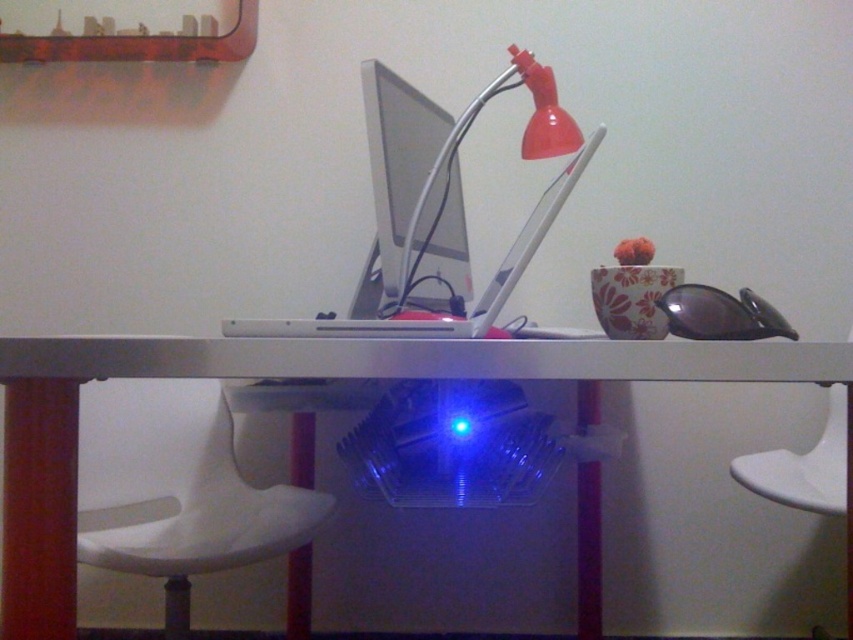
Question: Is white plastic chair at lower left thinner than sleek silver laptop at center?

Choices:
 (A) yes
 (B) no

Answer: (A)

Question: Does transparent plastic tray at center appear on the left side of satin silver monitor at center?

Choices:
 (A) yes
 (B) no

Answer: (B)

Question: Does white plastic chair at lower left appear on the right side of matte plastic lamp at upper center?

Choices:
 (A) no
 (B) yes

Answer: (A)

Question: Which of the following is the farthest from the observer?

Choices:
 (A) sleek silver laptop at center
 (B) satin silver monitor at center

Answer: (B)

Question: Which point is closer to the camera taking this photo?

Choices:
 (A) (78, 364)
 (B) (412, 115)
 (C) (465, 321)

Answer: (A)

Question: Which point is closer to the camera?

Choices:
 (A) (97, 557)
 (B) (387, 221)

Answer: (B)